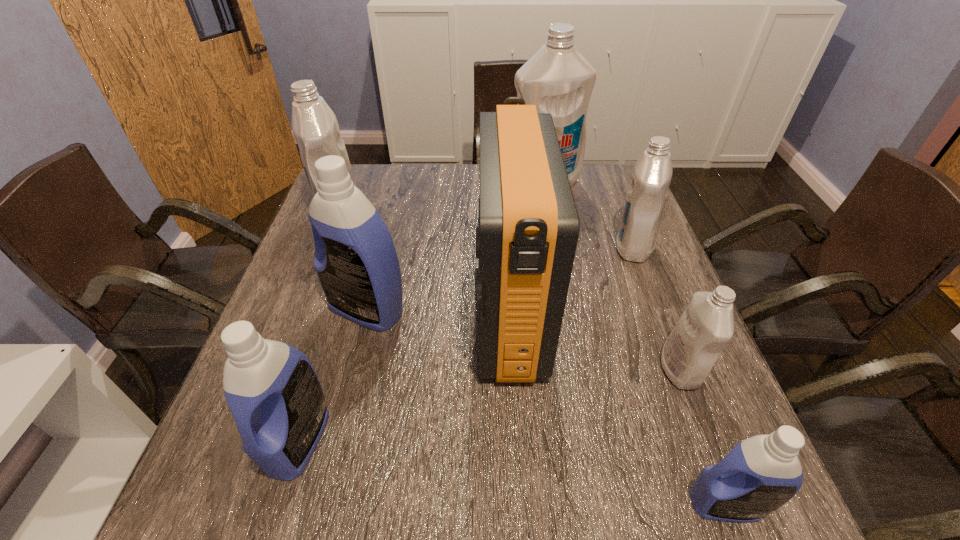
In order to click on vacant point that satisfies the following two spatial constraints: 1. on the back side of the farthest detergent; 2. on the right side of the second smallest blue detergent in this screenshot , I will do `click(377, 183)`.